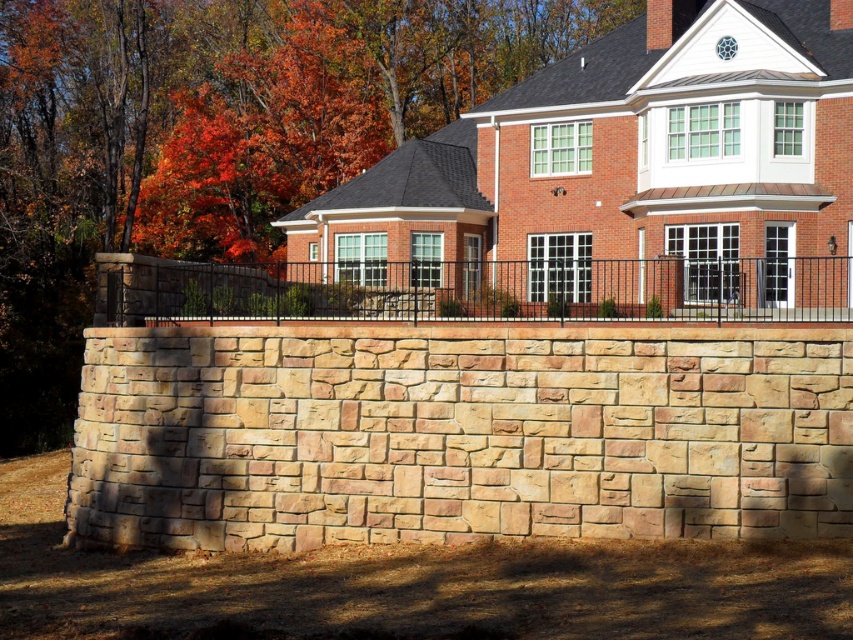
Question: Does orange leafy tree at upper center have a greater width compared to black metal fence at center?

Choices:
 (A) no
 (B) yes

Answer: (B)

Question: Can you confirm if orange leafy tree at upper center is positioned below black metal fence at center?

Choices:
 (A) yes
 (B) no

Answer: (B)

Question: Among these points, which one is nearest to the camera?

Choices:
 (A) (19, 298)
 (B) (640, 284)

Answer: (B)

Question: Is orange leafy tree at upper center wider than black metal fence at center?

Choices:
 (A) yes
 (B) no

Answer: (A)